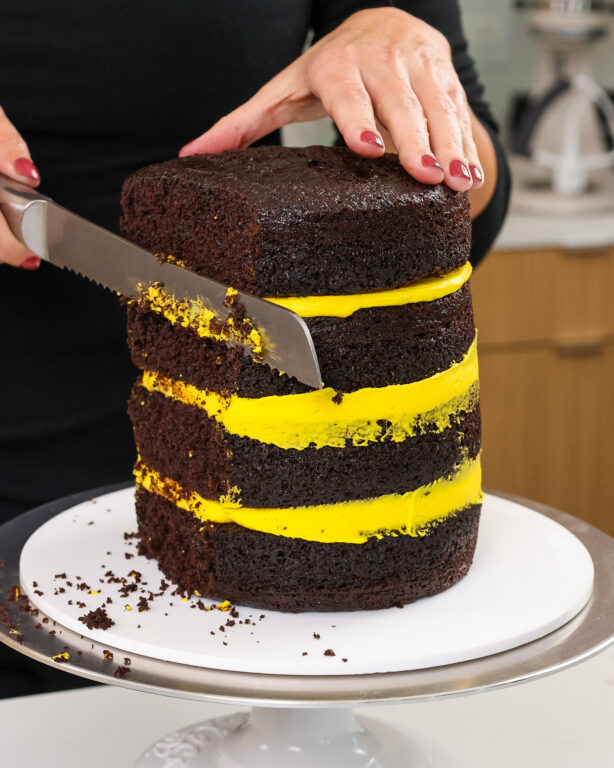
In order to click on plate in this screenshot , I will do `click(488, 683)`.